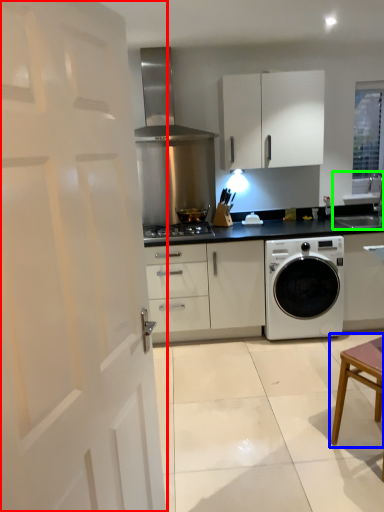
Question: Which object is the farthest from door (highlighted by a red box)? Choose among these: table (highlighted by a blue box) or sink (highlighted by a green box).

Choices:
 (A) table
 (B) sink

Answer: (B)